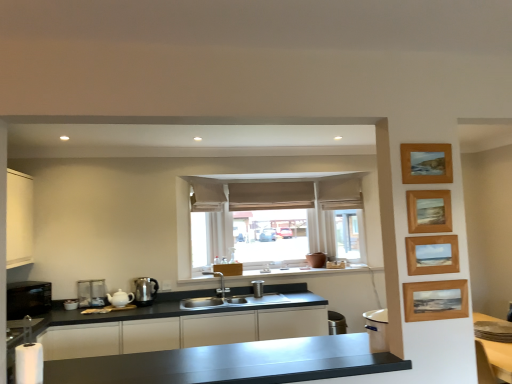
Locate an element on the screen. The width and height of the screenshot is (512, 384). free space above white fabric curtain at upper center, arranged as the third curtain when viewed from the right (from a real-world perspective) is located at coordinates (206, 182).